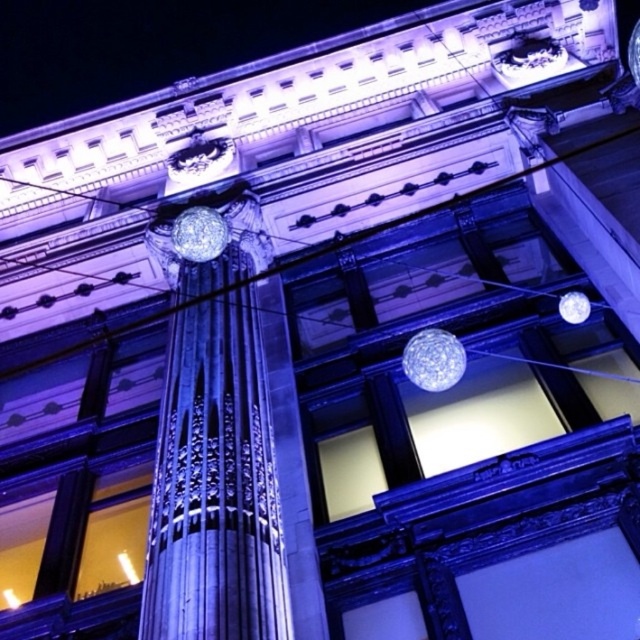
Can you confirm if satin silver column at center is shorter than transparent glass sphere at upper right?

No, satin silver column at center is not shorter than transparent glass sphere at upper right.

Does satin silver column at center have a greater height compared to transparent glass sphere at upper right?

Yes.

Does point (179, 444) lie behind point (577, 308)?

No, it is in front of (577, 308).

At what (x,y) coordinates should I click in order to perform the action: click on satin silver column at center. Please return your answer as a coordinate pair (x, y). The height and width of the screenshot is (640, 640). Looking at the image, I should click on (227, 440).

Between transparent glass sphere at center and transparent glass sphere at upper right, which one appears on the left side from the viewer's perspective?

transparent glass sphere at center is more to the left.

Which is in front, point (417, 365) or point (584, 321)?

Positioned in front is point (417, 365).

This screenshot has height=640, width=640. Find the location of `transparent glass sphere at center`. transparent glass sphere at center is located at coordinates (433, 358).

Does satin silver column at center have a larger size compared to transparent glass sphere at center?

Correct, satin silver column at center is larger in size than transparent glass sphere at center.

Is satin silver column at center shorter than transparent glass sphere at center?

Incorrect, satin silver column at center's height does not fall short of transparent glass sphere at center's.

Is point (285, 628) more distant than point (448, 381)?

No, it is in front of (448, 381).

Find the location of a particular element. satin silver column at center is located at coordinates (227, 440).